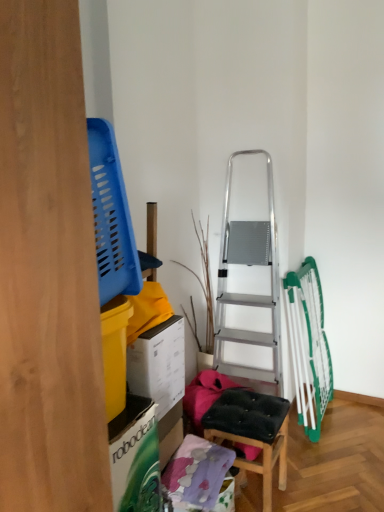
Question: Is white cardboard box at left shorter than black padded stool at center?

Choices:
 (A) yes
 (B) no

Answer: (A)

Question: Is white cardboard box at left located outside black padded stool at center?

Choices:
 (A) yes
 (B) no

Answer: (A)

Question: Is white cardboard box at left positioned before black padded stool at center?

Choices:
 (A) yes
 (B) no

Answer: (A)

Question: Can you confirm if white cardboard box at left is taller than black padded stool at center?

Choices:
 (A) yes
 (B) no

Answer: (B)

Question: From a real-world perspective, is white cardboard box at left under black padded stool at center?

Choices:
 (A) yes
 (B) no

Answer: (B)

Question: Are white cardboard box at left and black padded stool at center making contact?

Choices:
 (A) yes
 (B) no

Answer: (B)

Question: Is black padded stool at center to the left of white cardboard box at left from the viewer's perspective?

Choices:
 (A) yes
 (B) no

Answer: (B)

Question: Does black padded stool at center have a smaller size compared to white cardboard box at left?

Choices:
 (A) no
 (B) yes

Answer: (A)

Question: Can you confirm if black padded stool at center is positioned to the right of white cardboard box at left?

Choices:
 (A) no
 (B) yes

Answer: (B)

Question: From a real-world perspective, does black padded stool at center sit lower than white cardboard box at left?

Choices:
 (A) yes
 (B) no

Answer: (A)

Question: Does black padded stool at center have a greater height compared to white cardboard box at left?

Choices:
 (A) no
 (B) yes

Answer: (B)

Question: Is black padded stool at center outside of white cardboard box at left?

Choices:
 (A) no
 (B) yes

Answer: (B)

Question: Would you say black padded stool at center is inside or outside white cardboard box at left?

Choices:
 (A) inside
 (B) outside

Answer: (B)